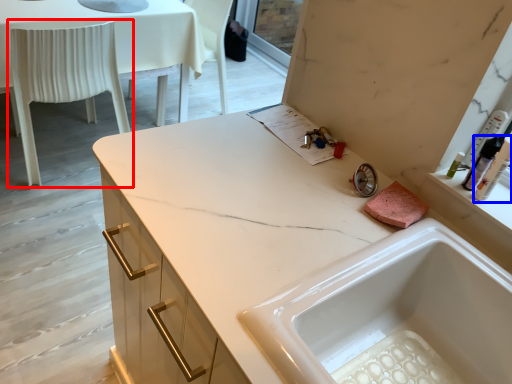
Question: Which point is further to the camera, chair (highlighted by a red box) or toiletry (highlighted by a blue box)?

Choices:
 (A) chair
 (B) toiletry

Answer: (A)